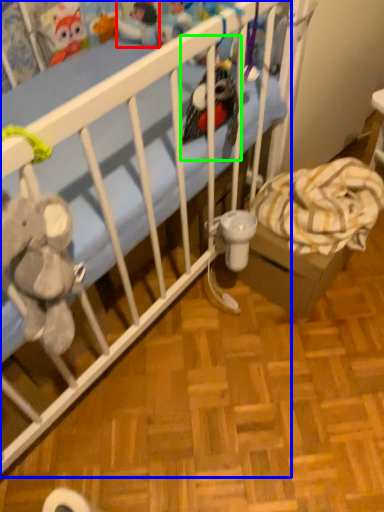
Question: Considering the real-world distances, which object is closest to toy (highlighted by a red box)? infant bed (highlighted by a blue box) or toy (highlighted by a green box).

Choices:
 (A) infant bed
 (B) toy

Answer: (B)